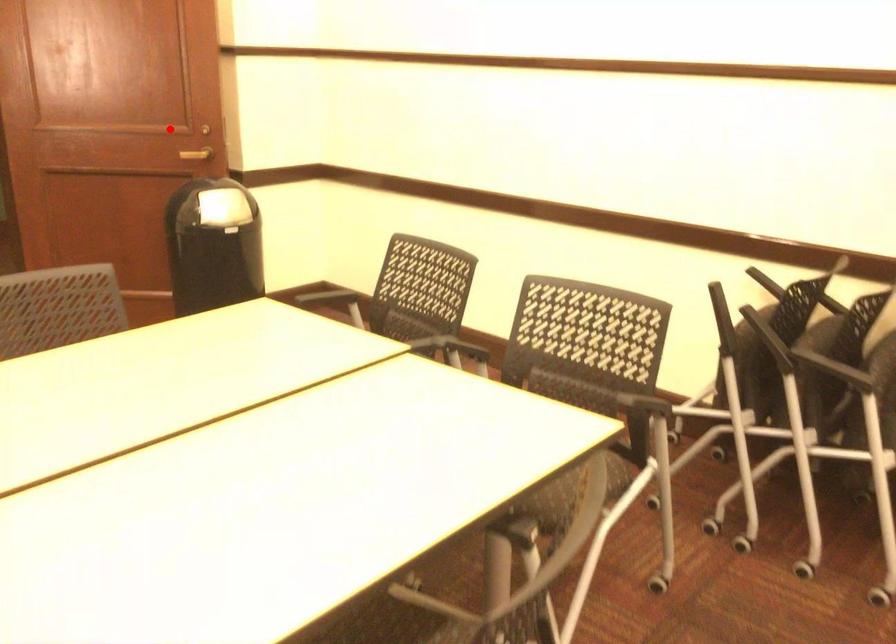
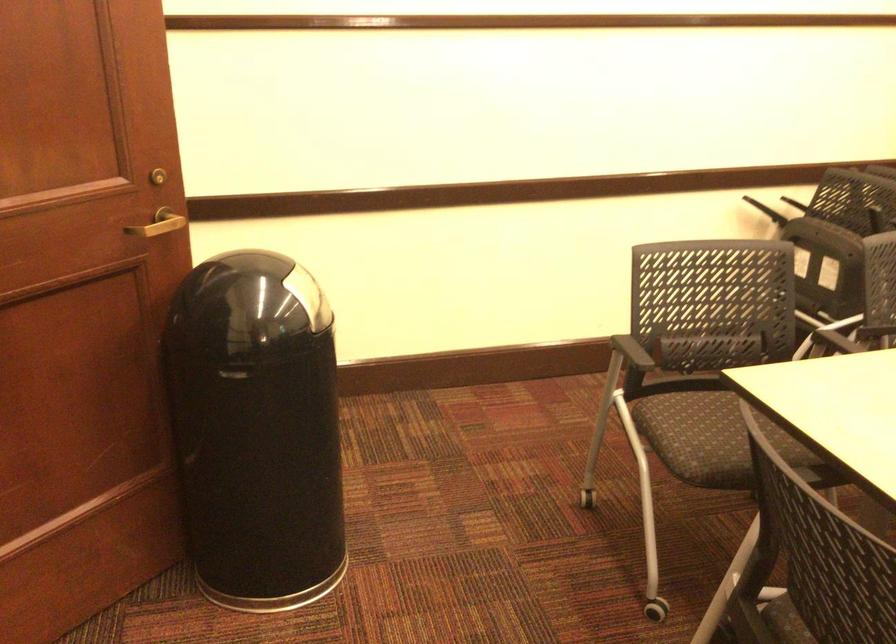
Question: I am providing you with two images of the same scene from different viewpoints. Image1 has a red point marked. In image2, the corresponding 3D location appears at what relative position? Reply with the corresponding letter.

Choices:
 (A) Closer
 (B) Farther

Answer: (A)